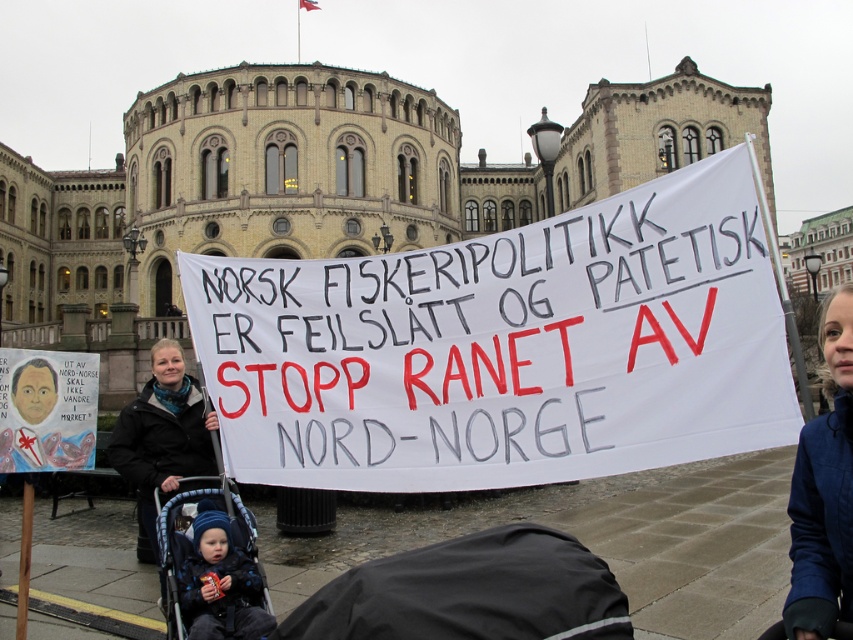
Based on the scene description, where is the white paper banner at center located in the image?

The white paper banner at center is located at point [508,348] in the image.

You are a photographer standing at the edge of the protest scene. You want to capture a photo that includes both the black jacket at center and the blue fleece hat at lower left. What is the minimum distance you need to move backward to ensure both objects are in frame?

The black jacket at center is 4.18 meters from the blue fleece hat at lower left. To include both in the frame, you need to move backward until the distance between them fits within your camera lens field of view. However, without knowing the lens focal length or sensor size, an exact distance cannot be calculated. A safe estimate would be moving back at least 5 meters to ensure both objects are visible in the shot.